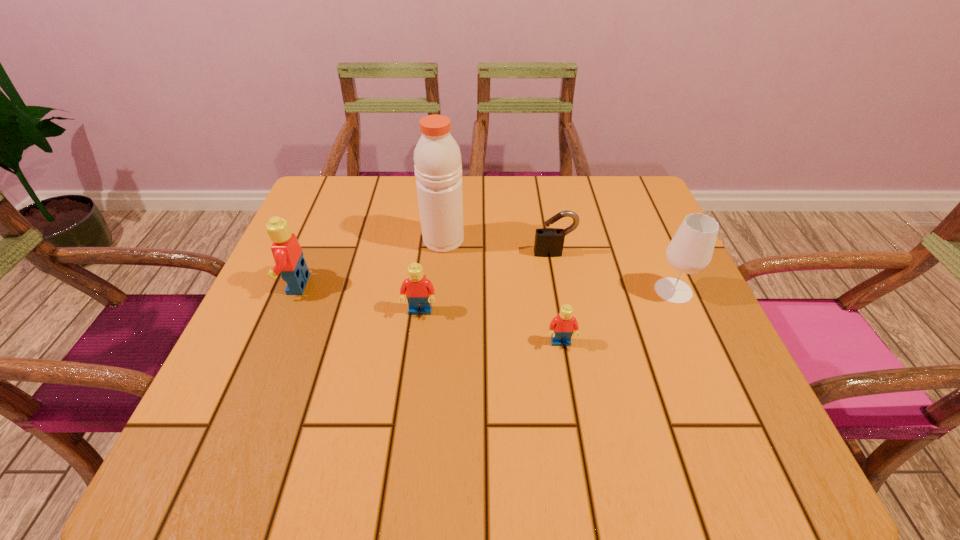
The height and width of the screenshot is (540, 960). In the image, there is a desktop. What are the coordinates of `vacant space at the right edge` in the screenshot? It's located at (659, 243).

You are a GUI agent. You are given a task and a screenshot of the screen. Output one action in this format:
    pyautogui.click(x=<x>, y=<y>)
    Task: Click on the free location at the far left corner
    The width and height of the screenshot is (960, 540).
    Given the screenshot: What is the action you would take?
    pyautogui.click(x=353, y=181)

In the image, there is a desktop. Where is `vacant space at the far right corner`? This screenshot has height=540, width=960. vacant space at the far right corner is located at coordinates (627, 215).

Locate an element on the screen. vacant area at the near right corner is located at coordinates (668, 376).

The width and height of the screenshot is (960, 540). Identify the location of empty space that is in between the second nearest Lego and the padlock. point(487,282).

I want to click on vacant region between the tallest object and the leftmost Lego, so click(x=370, y=262).

Where is `free space between the farthest Lego and the second Lego from right to left`? This screenshot has width=960, height=540. free space between the farthest Lego and the second Lego from right to left is located at coordinates (358, 298).

Where is `empty location between the farthest Lego and the rightmost object`? This screenshot has height=540, width=960. empty location between the farthest Lego and the rightmost object is located at coordinates (485, 287).

Identify the location of free point between the padlock and the tallest object. The width and height of the screenshot is (960, 540). (498, 247).

Identify the location of unoccupied area between the second Lego from left to right and the shaker. (432, 276).